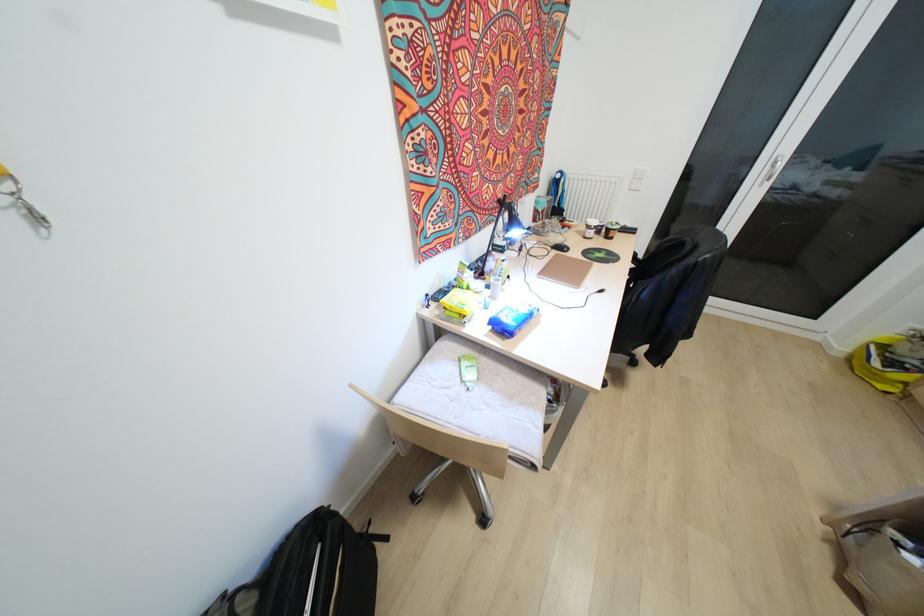
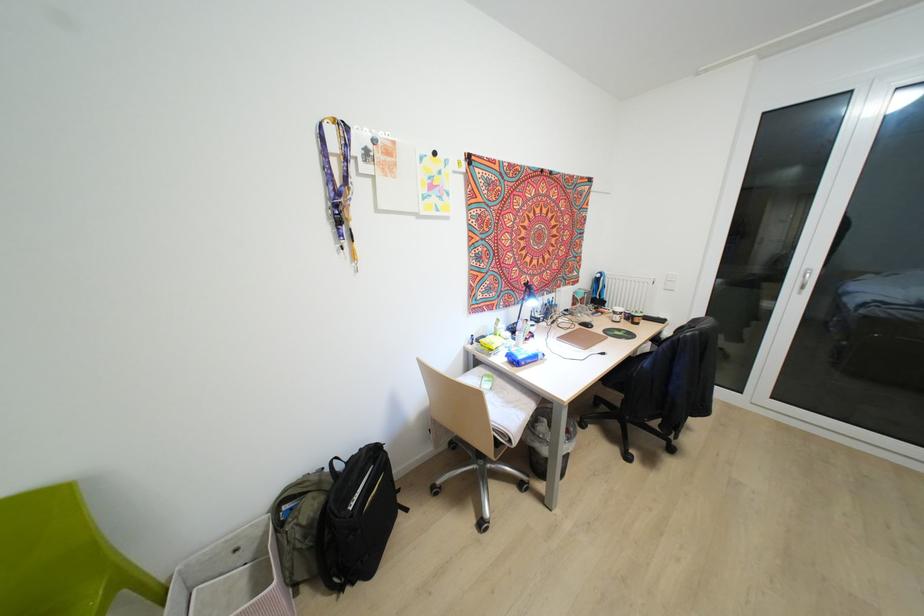
In the second image, find the point that corresponds to (x=566, y=249) in the first image.

(591, 326)